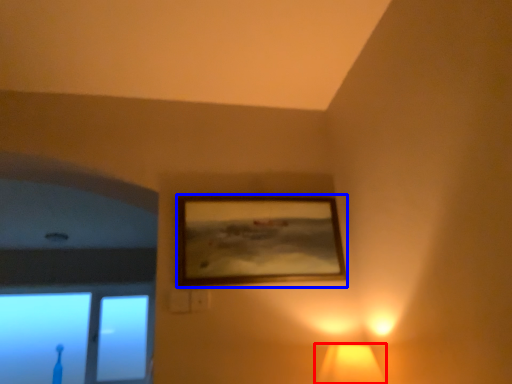
Question: Which point is closer to the camera, lamp (highlighted by a red box) or picture frame (highlighted by a blue box)?

Choices:
 (A) lamp
 (B) picture frame

Answer: (A)